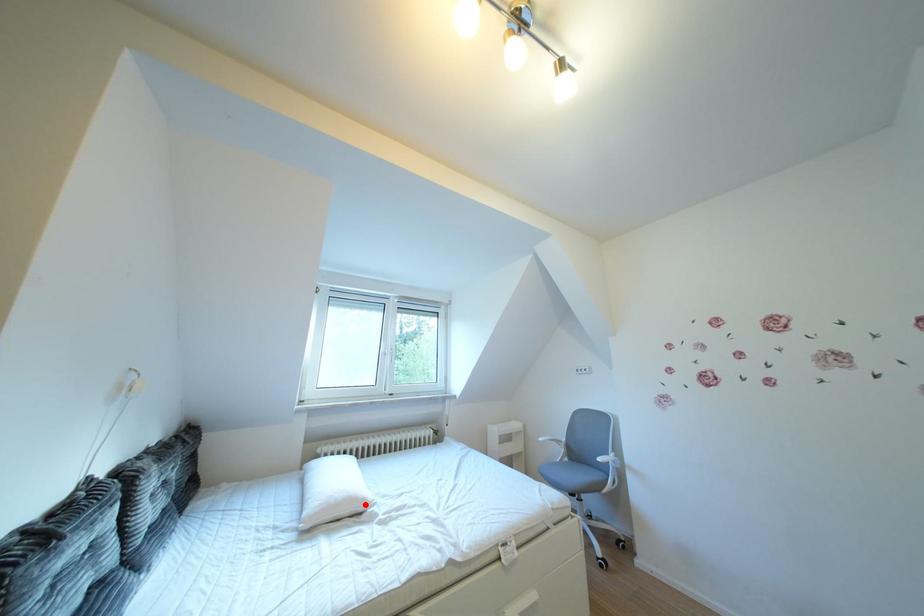
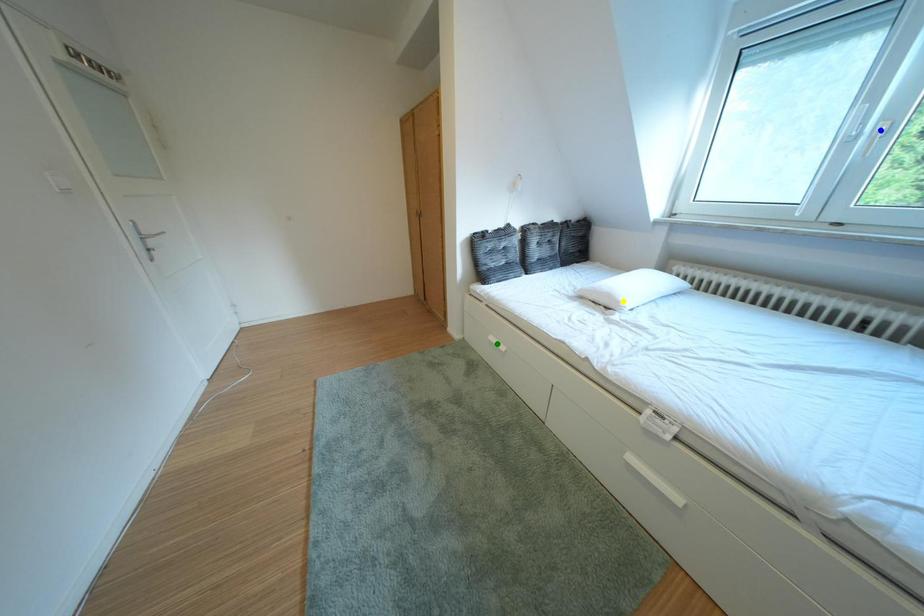
Question: I am providing you with two images of the same scene from different viewpoints. A red point is marked on the first image. You are given multiple points on the second image. Which point in image 2 represents the same 3d spot as the red point in image 1?

Choices:
 (A) green point
 (B) yellow point
 (C) blue point

Answer: (B)